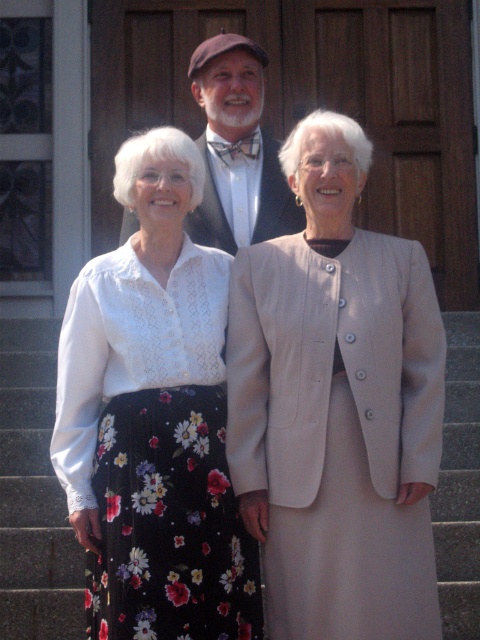
Question: Among these objects, which one is farthest from the camera?

Choices:
 (A) matte black bow tie at center
 (B) floral-patterned skirt at center

Answer: (A)

Question: Which object is closer to the camera taking this photo?

Choices:
 (A) black floral skirt at lower left
 (B) beige fabric skirt at center

Answer: (B)

Question: Does beige fabric skirt at center have a greater width compared to black floral skirt at lower left?

Choices:
 (A) no
 (B) yes

Answer: (B)

Question: Is black floral skirt at lower left to the left of matte black bow tie at center from the viewer's perspective?

Choices:
 (A) no
 (B) yes

Answer: (B)

Question: Which point is farther from the camera taking this photo?

Choices:
 (A) (45, 396)
 (B) (178, 500)
 (C) (303, 436)

Answer: (A)

Question: Can you confirm if floral-patterned skirt at center is thinner than black floral skirt at lower left?

Choices:
 (A) no
 (B) yes

Answer: (A)